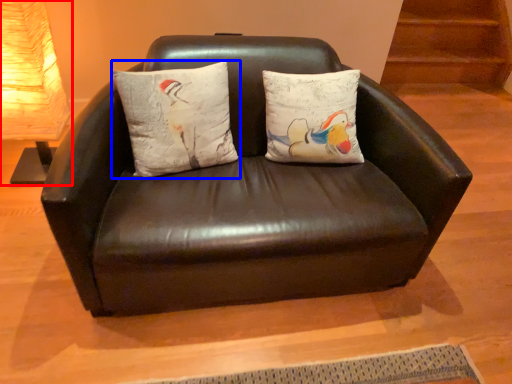
Question: Which of the following is the closest to the observer, table lamp (highlighted by a red box) or pillow (highlighted by a blue box)?

Choices:
 (A) table lamp
 (B) pillow

Answer: (B)